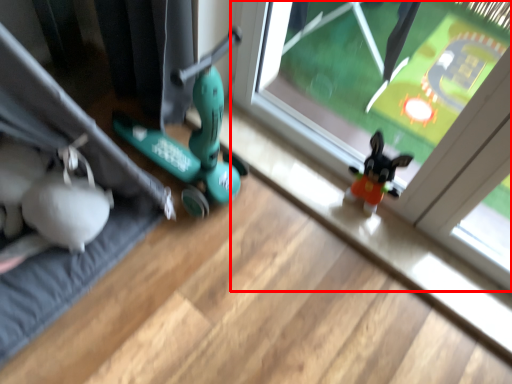
Question: From the image's perspective, what is the correct spatial relationship of window (annotated by the red box) in relation to yoga mat?

Choices:
 (A) above
 (B) below

Answer: (A)